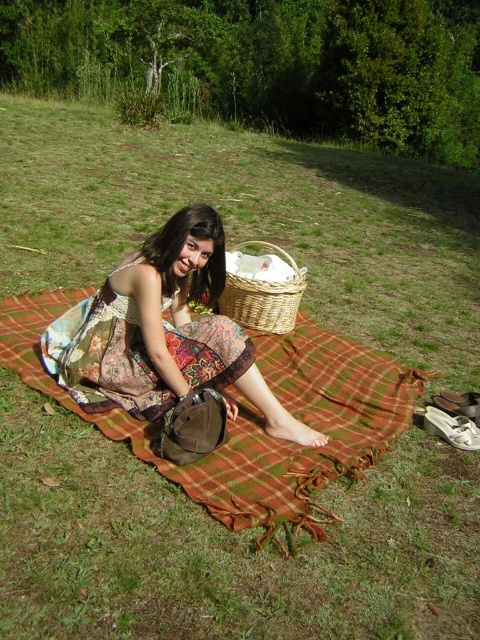
You are planning to lay out a picnic setup and need to know which item occupies more space. Based on the scene, which one is bigger between the plaid woolen blanket at center and the printed fabric dress at center?

The plaid woolen blanket at center has a larger size compared to the printed fabric dress at center, so the plaid woolen blanket at center occupies more space.

You are a photographer trying to capture the perfect shot of the scene. You want to ensure both the plaid woolen blanket at center and the printed fabric dress at center are visible in the frame. Based on their positions, which object is closer to the right edge of the image?

The plaid woolen blanket at center is to the right of the printed fabric dress at center, so the plaid woolen blanket at center is closer to the right edge of the image.